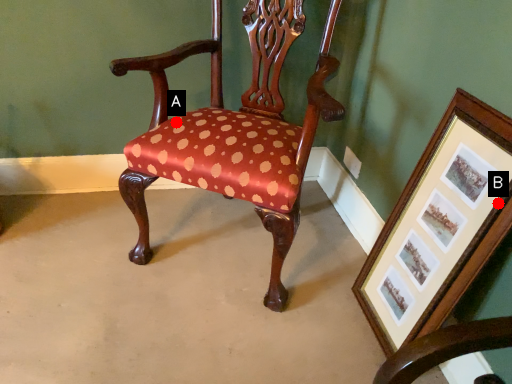
Question: Two points are circled on the image, labeled by A and B beside each circle. Which point is closer to the camera?

Choices:
 (A) A is closer
 (B) B is closer

Answer: (B)